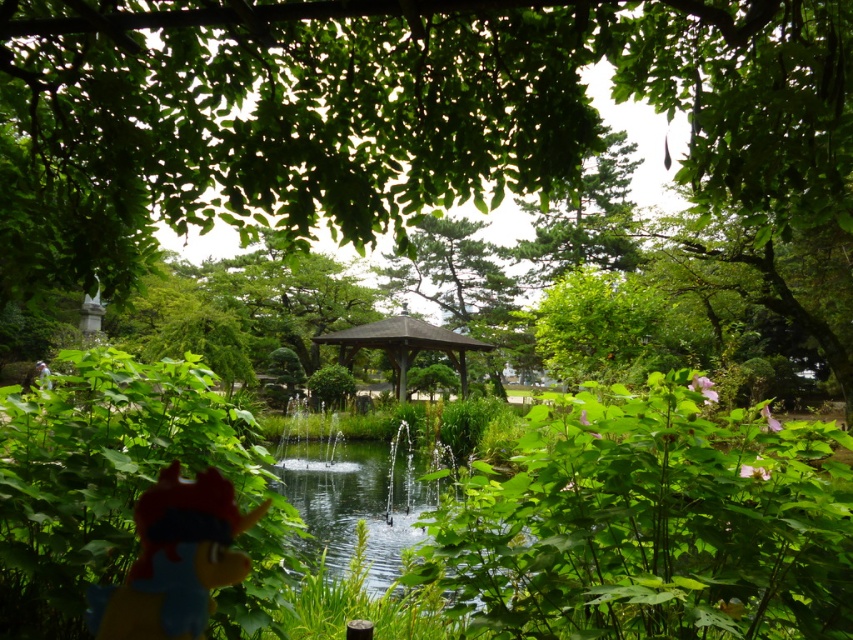
You are a child visiting the park and see the plush red toy at lower left and the smooth gray gazebo at center. Which object is bigger?

The plush red toy at lower left is smaller than the smooth gray gazebo at center, so the smooth gray gazebo at center is bigger.

Looking at this image, you are a child visiting the park and see the plush red toy at lower left and the smooth gray gazebo at center. Which object is closer to you?

The plush red toy at lower left is closer to you because it is located below the smooth gray gazebo at center, which places it in the foreground.